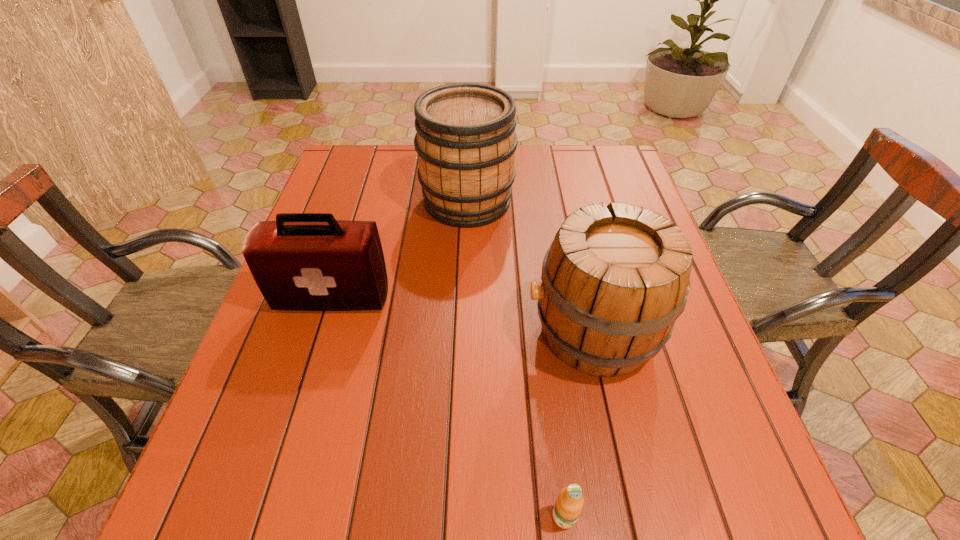
Identify the location of vacant space located on the side of the first aid kit with the cross symbol. (302, 395).

Locate an element on the screen. The height and width of the screenshot is (540, 960). object at the far edge is located at coordinates (466, 141).

I want to click on object that is at the near edge, so click(569, 503).

This screenshot has height=540, width=960. Find the location of `object that is positioned at the left edge`. object that is positioned at the left edge is located at coordinates point(302,261).

The width and height of the screenshot is (960, 540). I want to click on object present at the right edge, so click(x=614, y=280).

You are a GUI agent. You are given a task and a screenshot of the screen. Output one action in this format:
    pyautogui.click(x=<x>, y=<y>)
    Task: Click on the blank space at the far edge of the desktop
    The width and height of the screenshot is (960, 540).
    Given the screenshot: What is the action you would take?
    pyautogui.click(x=401, y=154)

Where is `vacant space at the near edge`? The height and width of the screenshot is (540, 960). vacant space at the near edge is located at coordinates (375, 532).

In order to click on free location at the left edge in this screenshot , I will do `click(252, 357)`.

This screenshot has height=540, width=960. In the image, there is a desktop. In order to click on free space at the far left corner in this screenshot , I will do `click(346, 163)`.

At what (x,y) coordinates should I click in order to perform the action: click on vacant space at the near left corner of the desktop. Please return your answer as a coordinate pair (x, y). The image size is (960, 540). Looking at the image, I should click on (252, 519).